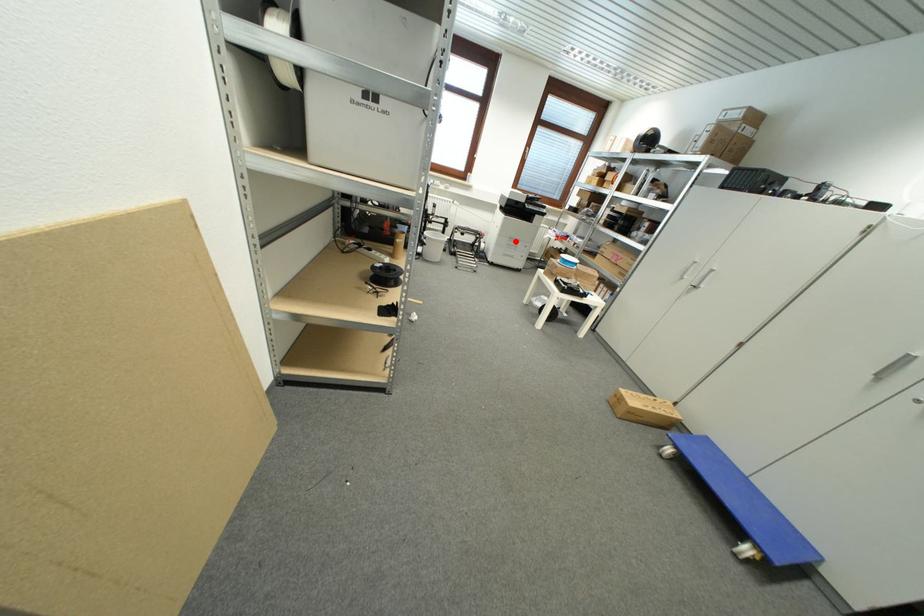
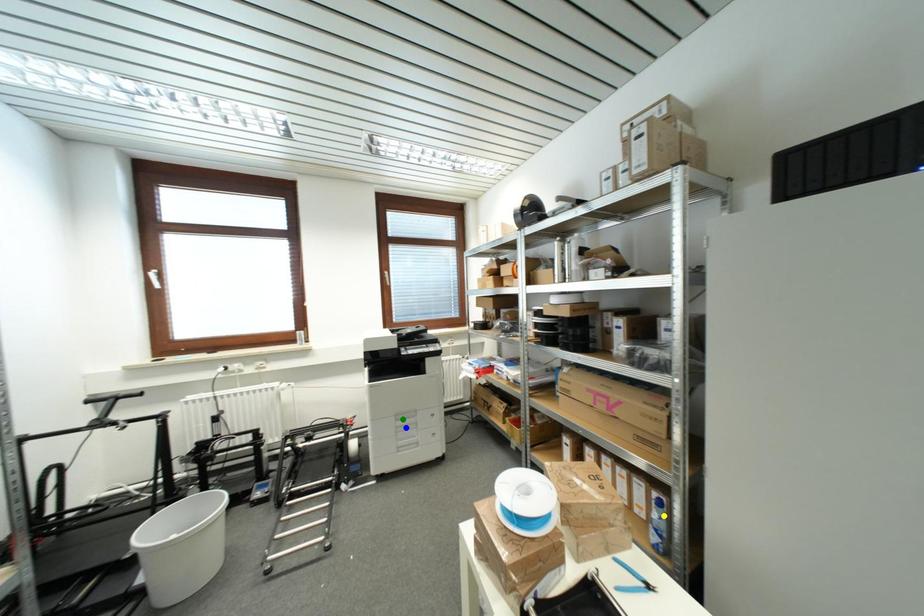
Question: I am providing you with two images of the same scene from different viewpoints. A red point is marked on the first image. You are given multiple points on the second image. Which mark in image 2 goes with the point in image 1?

Choices:
 (A) yellow point
 (B) green point
 (C) blue point

Answer: (B)